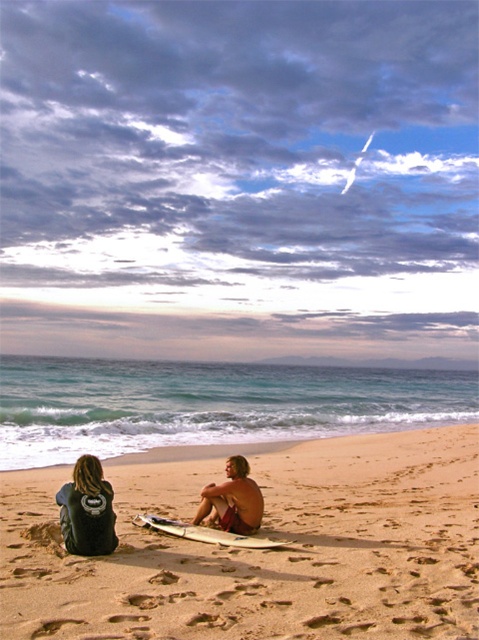
Question: Is smooth sand surfboard at center to the right of shiny brown skin at center from the viewer's perspective?

Choices:
 (A) yes
 (B) no

Answer: (B)

Question: Which object is farther from the camera taking this photo?

Choices:
 (A) white glossy surfboard at center
 (B) matte black wetsuit at lower left

Answer: (B)

Question: Which of the following is the closest to the observer?

Choices:
 (A) white glossy surfboard at center
 (B) black leather jacket at lower left
 (C) shiny brown skin at center
 (D) smooth sand surfboard at center

Answer: (D)

Question: Which point is closer to the camera?

Choices:
 (A) black leather jacket at lower left
 (B) white glossy surfboard at center
 (C) shiny brown skin at center
 (D) matte black wetsuit at lower left

Answer: (A)

Question: Does smooth sand surfboard at center have a smaller size compared to matte black wetsuit at lower left?

Choices:
 (A) yes
 (B) no

Answer: (B)

Question: Is matte black wetsuit at lower left further to camera compared to black leather jacket at lower left?

Choices:
 (A) no
 (B) yes

Answer: (B)